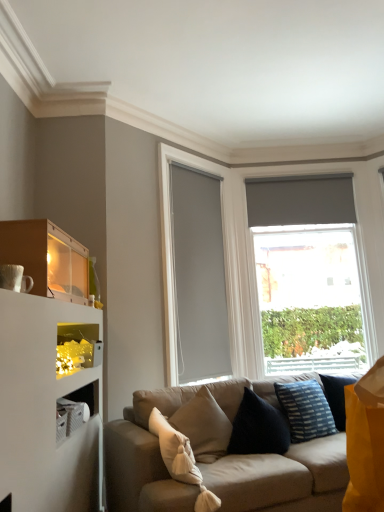
Identify the location of beige fabric pillow at center, which is counted as the 1th pillow, starting from the front. This screenshot has width=384, height=512. (181, 460).

Where is `iridescent plastic lights at lower left`? iridescent plastic lights at lower left is located at coordinates (77, 348).

What is the approximate width of matte gray glass door at center?

matte gray glass door at center is 4.12 inches in width.

Where is `matte wood shelf at upper left`? The image size is (384, 512). matte wood shelf at upper left is located at coordinates (47, 258).

From the image's perspective, relative to matte gray roller blind at right, is beige fabric pillow at center, which is the 2th pillow in back-to-front order, above or below?

beige fabric pillow at center, which is the 2th pillow in back-to-front order, is situated lower than matte gray roller blind at right in the image.

Is beige fabric pillow at center, which is the 2th pillow in back-to-front order, further to camera compared to matte gray roller blind at right?

That is False.

In the scene shown: Is beige fabric pillow at center, which is counted as the 1th pillow, starting from the front, bigger than matte gray roller blind at right?

Incorrect, beige fabric pillow at center, which is counted as the 1th pillow, starting from the front, is not larger than matte gray roller blind at right.

How many degrees apart are the facing directions of beige fabric pillow at center, which is the 2th pillow in back-to-front order, and matte gray roller blind at right?

The angle between the facing direction of beige fabric pillow at center, which is the 2th pillow in back-to-front order, and the facing direction of matte gray roller blind at right is 22.2 degrees.

From a real-world perspective, is matte gray roller blind at right physically located above or below blue striped fabric pillow at lower right, the 2th pillow in the left-to-right sequence?

matte gray roller blind at right is above blue striped fabric pillow at lower right, the 2th pillow in the left-to-right sequence.

Would you say matte gray roller blind at right is inside or outside blue striped fabric pillow at lower right, which is the first pillow from back to front?

matte gray roller blind at right is spatially situated outside blue striped fabric pillow at lower right, which is the first pillow from back to front.

Which object is wider, matte gray roller blind at right or blue striped fabric pillow at lower right, which is the first pillow from back to front?

blue striped fabric pillow at lower right, which is the first pillow from back to front, is wider.

Is matte gray roller blind at right aimed at blue striped fabric pillow at lower right, which is the first pillow from back to front?

Yes, matte gray roller blind at right is facing blue striped fabric pillow at lower right, which is the first pillow from back to front.

From the image's perspective, does matte wood shelf at upper left appear lower than matte gray glass door at center?

Incorrect, from the image's perspective, matte wood shelf at upper left is higher than matte gray glass door at center.

Considering the positions of point (68, 254) and point (194, 236), is point (68, 254) closer or farther from the camera than point (194, 236)?

Point (68, 254) appears to be closer to the viewer than point (194, 236).

Is matte wood shelf at upper left to the left of matte gray glass door at center from the viewer's perspective?

Yes.

From the image's perspective, starting from the matte gray glass door at center, which pillow is the 2nd one below? Please provide its 2D coordinates.

[(181, 460)]

How distant is matte gray glass door at center from beige fabric pillow at center, the second pillow positioned from the right?

A distance of 1.61 meters exists between matte gray glass door at center and beige fabric pillow at center, the second pillow positioned from the right.

Considering the positions of points (169, 379) and (200, 490), is point (169, 379) farther from camera compared to point (200, 490)?

That is True.

Looking at this image, is matte gray glass door at center shorter than beige fabric pillow at center, positioned as the 1th pillow in left-to-right order?

No.

Is matte gray glass door at center taller or shorter than iridescent plastic lights at lower left?

In the image, matte gray glass door at center appears to be taller than iridescent plastic lights at lower left.

Would you consider matte gray glass door at center to be distant from iridescent plastic lights at lower left?

Yes, matte gray glass door at center is far from iridescent plastic lights at lower left.

From the picture: Is iridescent plastic lights at lower left surrounded by matte gray glass door at center?

No, matte gray glass door at center does not contain iridescent plastic lights at lower left.

Which object is further away from the camera, matte gray glass door at center or iridescent plastic lights at lower left?

matte gray glass door at center is further away from the camera.

Is matte gray glass door at center looking in the opposite direction of beige fabric couch at center?

No, matte gray glass door at center's orientation is not away from beige fabric couch at center.

Is matte gray glass door at center completely or partially outside of beige fabric couch at center?

Indeed, matte gray glass door at center is completely outside beige fabric couch at center.

From the picture: Is matte gray glass door at center wider than beige fabric couch at center?

In fact, matte gray glass door at center might be narrower than beige fabric couch at center.

Between matte gray glass door at center and beige fabric couch at center, which one has less height?

With less height is beige fabric couch at center.

Considering the positions of objects matte gray glass door at center and matte gray roller blind at right in the image provided, who is more to the left, matte gray glass door at center or matte gray roller blind at right?

matte gray glass door at center is more to the left.

This screenshot has width=384, height=512. In order to click on window above the matte gray glass door at center (from the image's perspective) in this screenshot , I will do `click(225, 267)`.

From a real-world perspective, between matte gray glass door at center and matte gray roller blind at right, who is vertically higher?

matte gray roller blind at right.

At what (x,y) coordinates should I click in order to perform the action: click on pillow that is the 2nd object located below the matte gray roller blind at right (from the image's perspective). Please return your answer as a coordinate pair (x, y). This screenshot has height=512, width=384. Looking at the image, I should click on (181, 460).

The width and height of the screenshot is (384, 512). Identify the location of window behind the blue striped fabric pillow at lower right, which is the first pillow from back to front. (225, 267).

Estimate the real-world distances between objects in this image. Which object is closer to matte wood shelf at upper left, iridescent plastic lights at lower left or matte gray glass door at center?

iridescent plastic lights at lower left is closer to matte wood shelf at upper left.

From the image, which object appears to be farther from blue striped fabric pillow at lower right, which is the first pillow from back to front, beige fabric couch at center or matte gray roller blind at right?

matte gray roller blind at right.

Considering their positions, is matte gray roller blind at right positioned closer to beige fabric couch at center than iridescent plastic lights at lower left?

iridescent plastic lights at lower left.

When comparing their distances from matte gray glass door at center, does blue striped fabric pillow at lower right, the 2th pillow in the left-to-right sequence, or beige fabric couch at center seem further?

The object further to matte gray glass door at center is blue striped fabric pillow at lower right, the 2th pillow in the left-to-right sequence.

From the image, which object appears to be farther from matte gray glass door at center, beige fabric couch at center or iridescent plastic lights at lower left?

iridescent plastic lights at lower left is further to matte gray glass door at center.

Considering their positions, is matte gray glass door at center positioned closer to matte gray roller blind at right than blue striped fabric pillow at lower right, arranged as the 1th pillow when viewed from the right?

The object closer to matte gray roller blind at right is matte gray glass door at center.

Looking at this image, from the image, which object appears to be farther from blue striped fabric pillow at lower right, arranged as the 1th pillow when viewed from the right, matte gray roller blind at right or matte wood shelf at upper left?

Based on the image, matte wood shelf at upper left appears to be further to blue striped fabric pillow at lower right, arranged as the 1th pillow when viewed from the right.

Based on their spatial positions, is beige fabric couch at center or blue striped fabric pillow at lower right, arranged as the 2th pillow when viewed from the front, further from matte gray glass door at center?

Based on the image, blue striped fabric pillow at lower right, arranged as the 2th pillow when viewed from the front, appears to be further to matte gray glass door at center.

Where is `cabinet positioned between beige fabric pillow at center, which is the 2th pillow in back-to-front order, and matte gray roller blind at right from near to far`? cabinet positioned between beige fabric pillow at center, which is the 2th pillow in back-to-front order, and matte gray roller blind at right from near to far is located at coordinates (77, 348).

Find the location of `glass door situated between iridescent plastic lights at lower left and matte gray roller blind at right from left to right`. glass door situated between iridescent plastic lights at lower left and matte gray roller blind at right from left to right is located at coordinates (195, 272).

This screenshot has width=384, height=512. I want to click on cabinet between beige fabric pillow at center, positioned as the 1th pillow in left-to-right order, and matte gray glass door at center, along the z-axis, so click(77, 348).

Image resolution: width=384 pixels, height=512 pixels. Find the location of `pillow between beige fabric couch at center and blue striped fabric pillow at lower right, which is the first pillow from back to front, from front to back`. pillow between beige fabric couch at center and blue striped fabric pillow at lower right, which is the first pillow from back to front, from front to back is located at coordinates (181, 460).